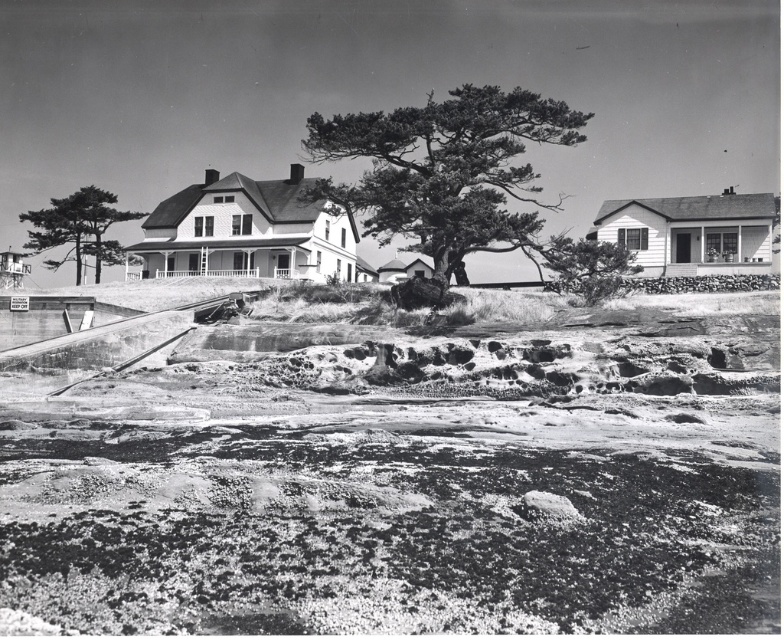
Based on the photo, is rocky terrain at lower center positioned in front of smooth bark tree at center?

Yes, it is in front of smooth bark tree at center.

Is rocky terrain at lower center to the left of smooth bark tree at center from the viewer's perspective?

Correct, you'll find rocky terrain at lower center to the left of smooth bark tree at center.

Does point (612, 509) come in front of point (630, 253)?

Yes, point (612, 509) is in front of point (630, 253).

Identify the location of rocky terrain at lower center. (400, 476).

From the picture: Is scaly bark tree at center taller than smooth bark tree at left?

Indeed, scaly bark tree at center has a greater height compared to smooth bark tree at left.

Between scaly bark tree at center and smooth bark tree at left, which one is positioned higher?

scaly bark tree at center is above.

Which is in front, point (510, 106) or point (24, 220)?

Point (510, 106)

Locate an element on the screen. The width and height of the screenshot is (784, 640). scaly bark tree at center is located at coordinates (445, 172).

Is point (147, 531) more distant than point (354, 136)?

No, (147, 531) is closer to viewer.

Consider the image. Measure the distance between rocky terrain at lower center and scaly bark tree at center.

A distance of 45.74 meters exists between rocky terrain at lower center and scaly bark tree at center.

Does point (158, 588) come behind point (338, 141)?

No, it is in front of (338, 141).

Identify the location of rocky terrain at lower center. The image size is (784, 640). (400, 476).